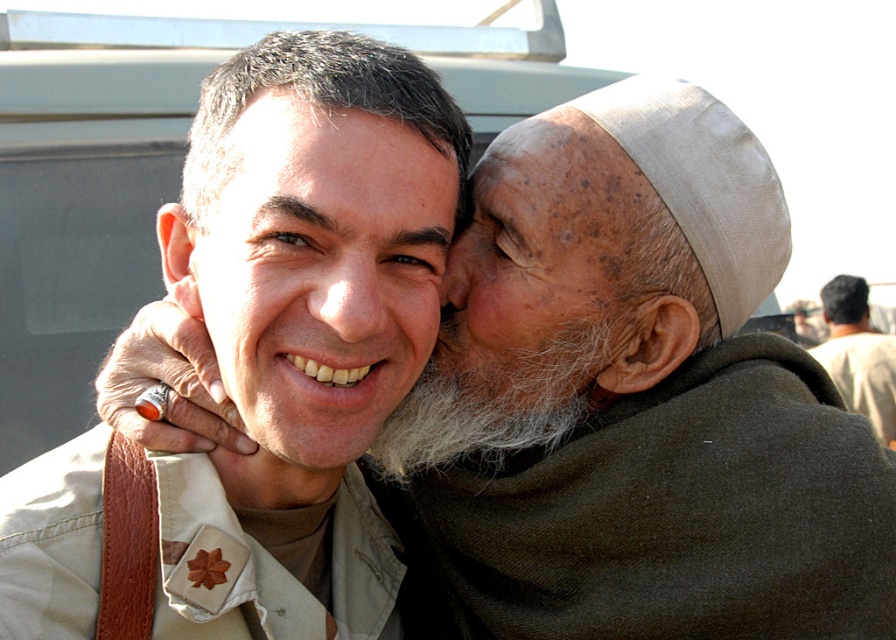
Consider the image. Can you confirm if beige uniform at center is thinner than matte khaki uniform at center?

No.

Can you confirm if beige uniform at center is positioned to the left of matte khaki uniform at center?

Yes, beige uniform at center is to the left of matte khaki uniform at center.

Where is `beige uniform at center`? beige uniform at center is located at coordinates (265, 368).

Can you confirm if beige fabric headscarf at upper right is positioned above dry skin ear at center?

Actually, beige fabric headscarf at upper right is below dry skin ear at center.

Does point (851, 376) come closer to viewer compared to point (606, 376)?

No, it is not.

Where is `beige fabric headscarf at upper right`? The image size is (896, 640). beige fabric headscarf at upper right is located at coordinates (858, 355).

In the scene shown: Can you confirm if matte khaki uniform at center is wider than beige fabric headscarf at upper right?

No, matte khaki uniform at center is not wider than beige fabric headscarf at upper right.

Between matte khaki uniform at center and beige fabric headscarf at upper right, which one appears on the left side from the viewer's perspective?

Positioned to the left is matte khaki uniform at center.

At what (x,y) coordinates should I click in order to perform the action: click on matte khaki uniform at center. Please return your answer as a coordinate pair (x, y). This screenshot has height=640, width=896. Looking at the image, I should click on (321, 280).